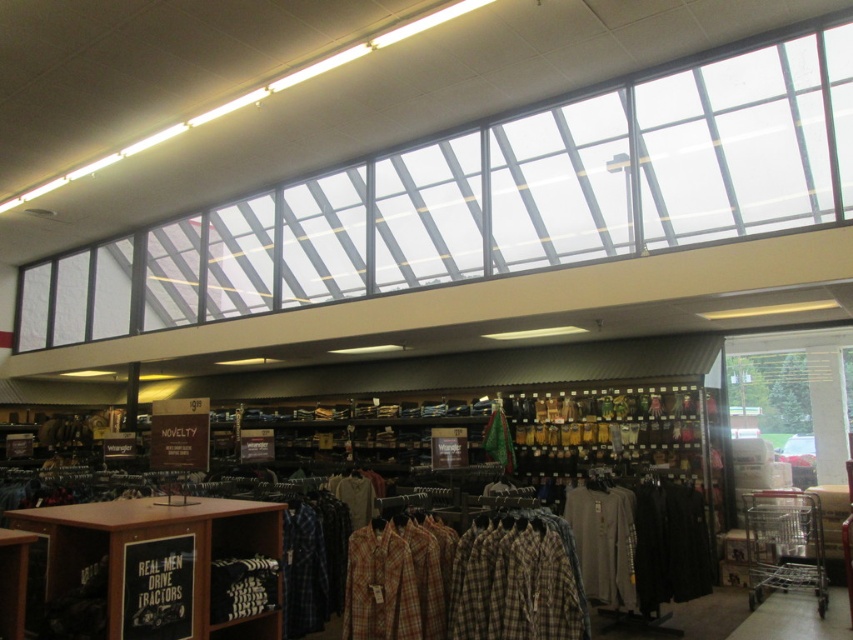
Question: Which point is closer to the camera taking this photo?

Choices:
 (A) (624, 541)
 (B) (488, 554)

Answer: (B)

Question: Does wooden shelf at lower left appear on the right side of gray cotton t-shirt at center?

Choices:
 (A) no
 (B) yes

Answer: (A)

Question: Which of the following is the farthest from the observer?

Choices:
 (A) gray cotton t-shirt at center
 (B) wooden shelf at lower left

Answer: (A)

Question: Does wooden shelf at lower left appear over gray cotton t-shirt at center?

Choices:
 (A) no
 (B) yes

Answer: (B)

Question: Is wooden shelf at lower left to the left of gray cotton t-shirt at center from the viewer's perspective?

Choices:
 (A) yes
 (B) no

Answer: (A)

Question: Which object appears farthest from the camera in this image?

Choices:
 (A) wooden shelf at lower left
 (B) gray cotton t-shirt at center

Answer: (B)